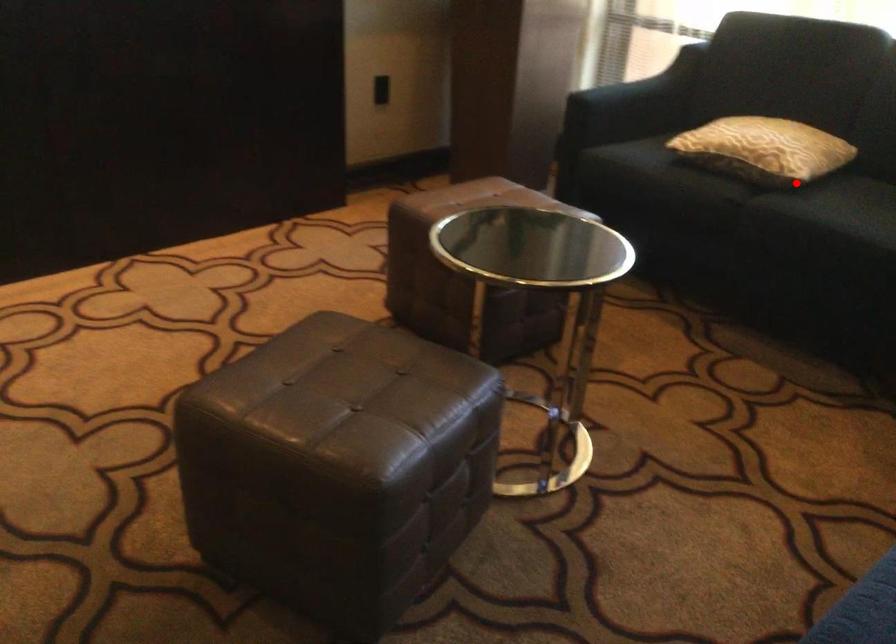
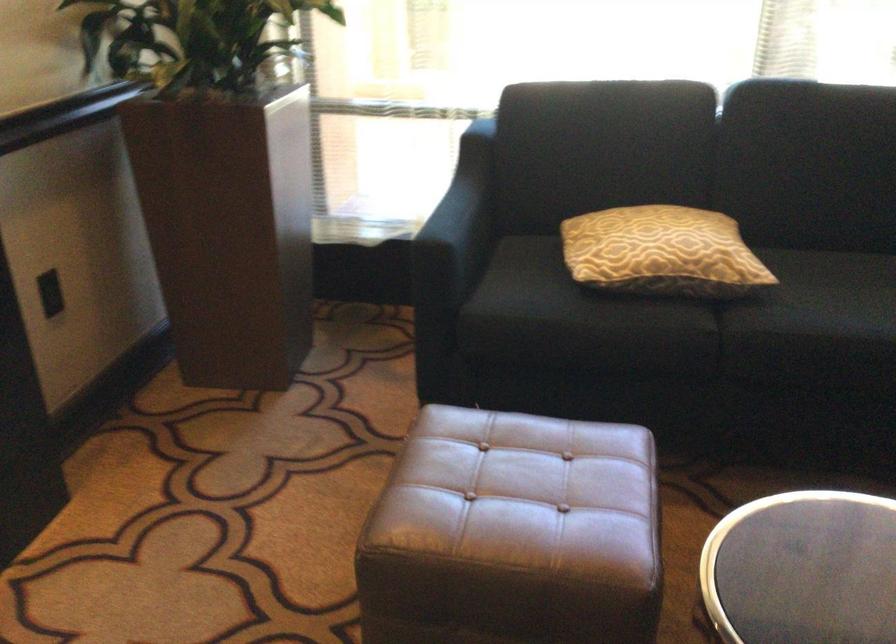
Where in the second image is the point corresponding to the highlighted location from the first image?

(752, 289)